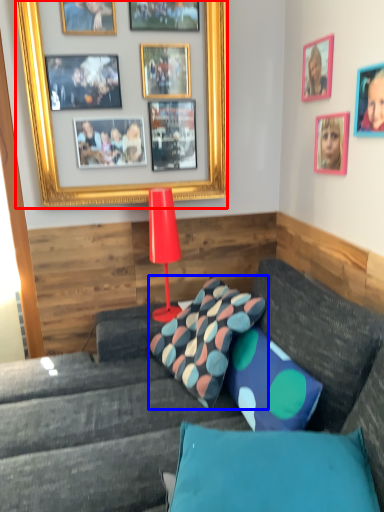
Question: Which object is closer to the camera taking this photo, picture frame (highlighted by a red box) or pillow (highlighted by a blue box)?

Choices:
 (A) picture frame
 (B) pillow

Answer: (B)